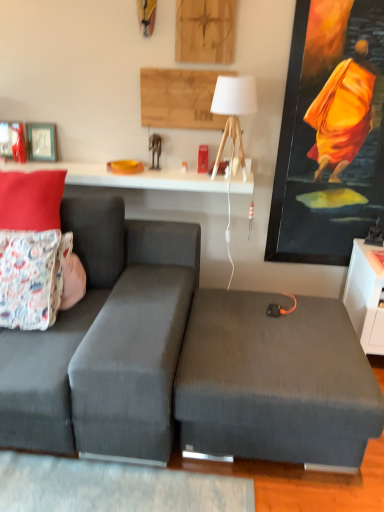
The width and height of the screenshot is (384, 512). I want to click on free area below white matte table lamp at upper center (from a real-world perspective), so click(225, 179).